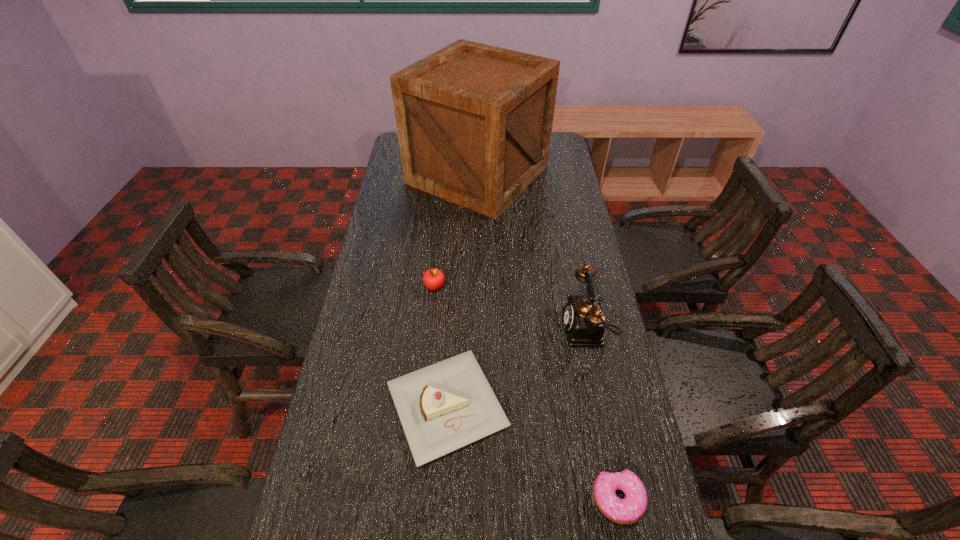
Where is `object situated at the far left corner`? The image size is (960, 540). object situated at the far left corner is located at coordinates point(474,122).

Where is `object that is positioned at the far right corner`? The height and width of the screenshot is (540, 960). object that is positioned at the far right corner is located at coordinates (474, 122).

At what (x,y) coordinates should I click in order to perform the action: click on free space at the left edge of the desktop. Please return your answer as a coordinate pair (x, y). The image size is (960, 540). Looking at the image, I should click on (408, 225).

I want to click on free space at the right edge of the desktop, so click(572, 176).

In the image, there is a desktop. In order to click on blank space at the far left corner in this screenshot , I will do `click(396, 140)`.

The width and height of the screenshot is (960, 540). What are the coordinates of `empty space that is in between the second tallest object and the farthest object` in the screenshot? It's located at (533, 252).

You are a GUI agent. You are given a task and a screenshot of the screen. Output one action in this format:
    pyautogui.click(x=<x>, y=<y>)
    Task: Click on the free space between the fourth nearest object and the telephone
    The image size is (960, 540).
    Given the screenshot: What is the action you would take?
    pyautogui.click(x=511, y=308)

Locate an element on the screen. The width and height of the screenshot is (960, 540). vacant area that lies between the farthest object and the apple is located at coordinates (456, 231).

Locate an element on the screen. Image resolution: width=960 pixels, height=540 pixels. free spot between the tallest object and the cake is located at coordinates (463, 291).

Locate an element on the screen. object that is the second closest to the apple is located at coordinates (474, 122).